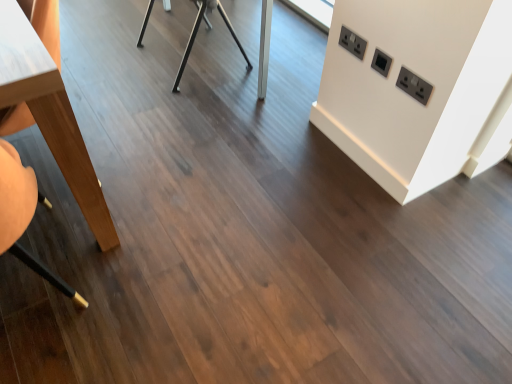
Question: Does point (351, 44) appear closer or farther from the camera than point (5, 231)?

Choices:
 (A) closer
 (B) farther

Answer: (B)

Question: From a real-world perspective, relative to wooden swivel chair at left, is black plastic/socket at upper right, which is the third electric outlet in bottom-to-top order, vertically above or below?

Choices:
 (A) below
 (B) above

Answer: (B)

Question: Which is nearer to the metallic silver table at center, which is the 2th table from left to right?

Choices:
 (A) light brown wood table at left, the 2th table viewed from the back
 (B) black plastic/socket at upper right, positioned as the 3th electric outlet in right-to-left order
 (C) wooden swivel chair at left
 (D) black plastic electric outlet at upper right, which ranks as the first electric outlet in bottom-to-top order
 (E) black plastic electric outlet at upper right, the 2th electric outlet from the right

Answer: (B)

Question: Considering the real-world distances, which object is closest to the black plastic electric outlet at upper right, positioned as the 1th electric outlet in right-to-left order?

Choices:
 (A) light brown wood table at left, placed as the first table when sorted from left to right
 (B) black plastic electric outlet at upper right, arranged as the 2th electric outlet when viewed from the left
 (C) metallic silver table at center, the first table viewed from the right
 (D) wooden swivel chair at left
 (E) black plastic/socket at upper right, which is the third electric outlet in bottom-to-top order

Answer: (B)